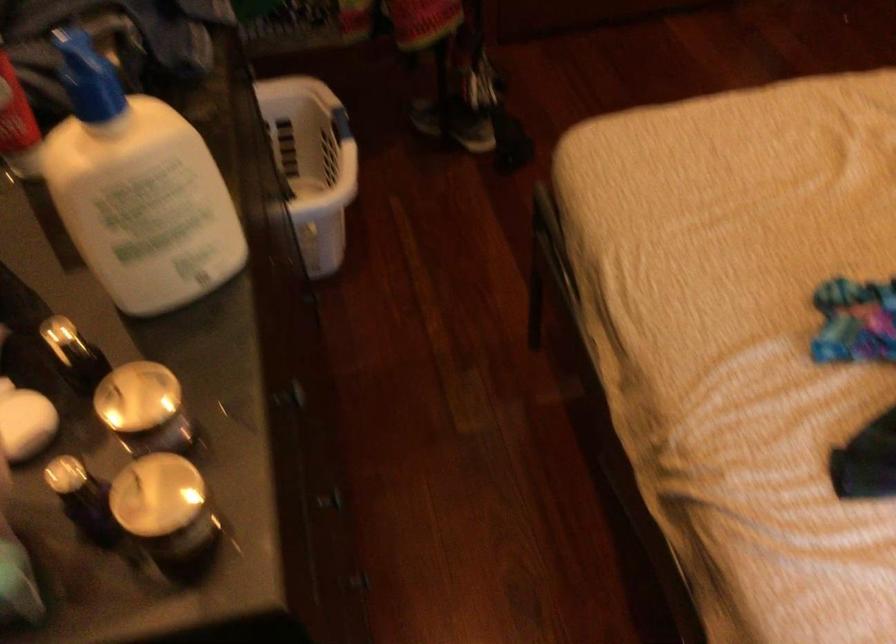
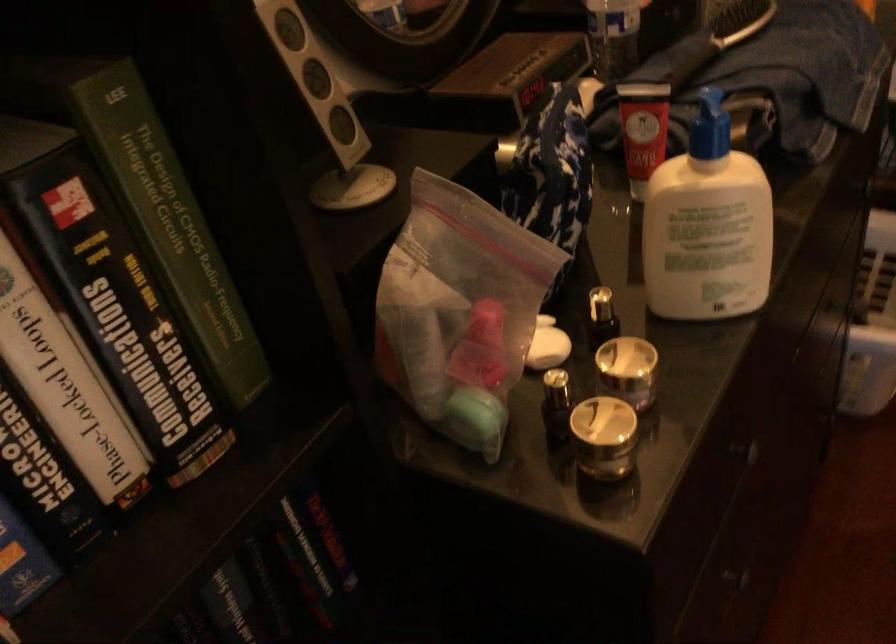
Find the pixel in the second image that matches (339,504) in the first image.

(738, 581)